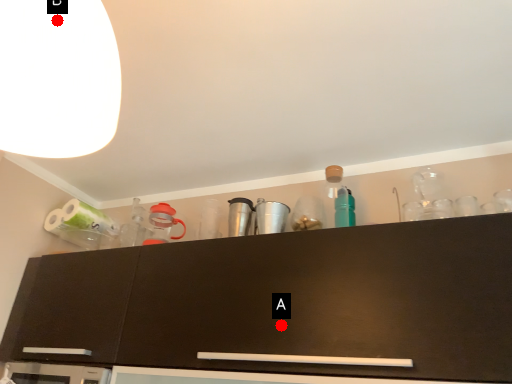
Question: Two points are circled on the image, labeled by A and B beside each circle. Which of the following is the closest to the observer?

Choices:
 (A) A is closer
 (B) B is closer

Answer: (B)